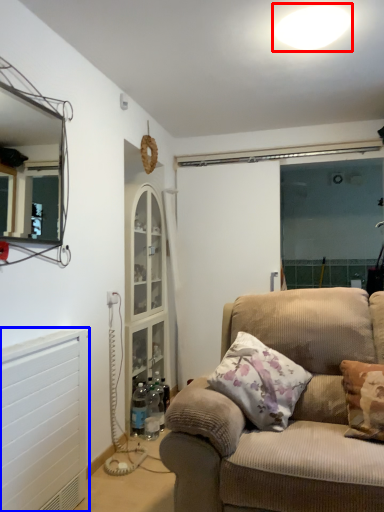
Question: Among these objects, which one is farthest to the camera, light (highlighted by a red box) or radiator (highlighted by a blue box)?

Choices:
 (A) light
 (B) radiator

Answer: (A)